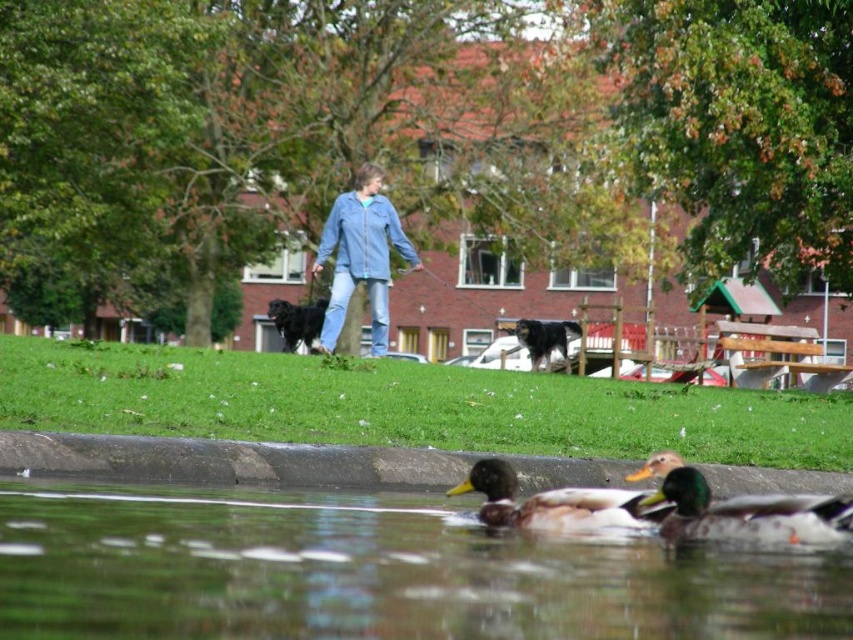
Question: Does denim jacket at center have a larger size compared to black shaggy dog at center?

Choices:
 (A) yes
 (B) no

Answer: (A)

Question: Estimate the real-world distances between objects in this image. Which object is closer to the greenish water at lower center?

Choices:
 (A) green glossy duck at lower center
 (B) black shaggy dog at center
 (C) denim jacket at center

Answer: (A)

Question: Can you confirm if greenish water at lower center is positioned above denim jacket at center?

Choices:
 (A) yes
 (B) no

Answer: (B)

Question: Among these points, which one is nearest to the camera?

Choices:
 (A) (735, 497)
 (B) (520, 324)
 (C) (405, 515)
 (D) (292, 323)

Answer: (C)

Question: Which of the following is the closest to the observer?

Choices:
 (A) (218, 579)
 (B) (639, 492)
 (C) (579, 330)
 (D) (376, 204)

Answer: (A)

Question: Can you confirm if denim jacket at center is smaller than brown feathered duck at lower center?

Choices:
 (A) yes
 (B) no

Answer: (B)